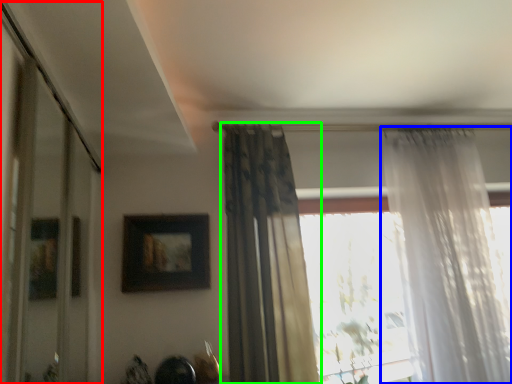
Question: Based on their relative distances, which object is nearer to glass door (highlighted by a red box)? Choose from curtain (highlighted by a blue box) and curtain (highlighted by a green box).

Choices:
 (A) curtain
 (B) curtain

Answer: (B)